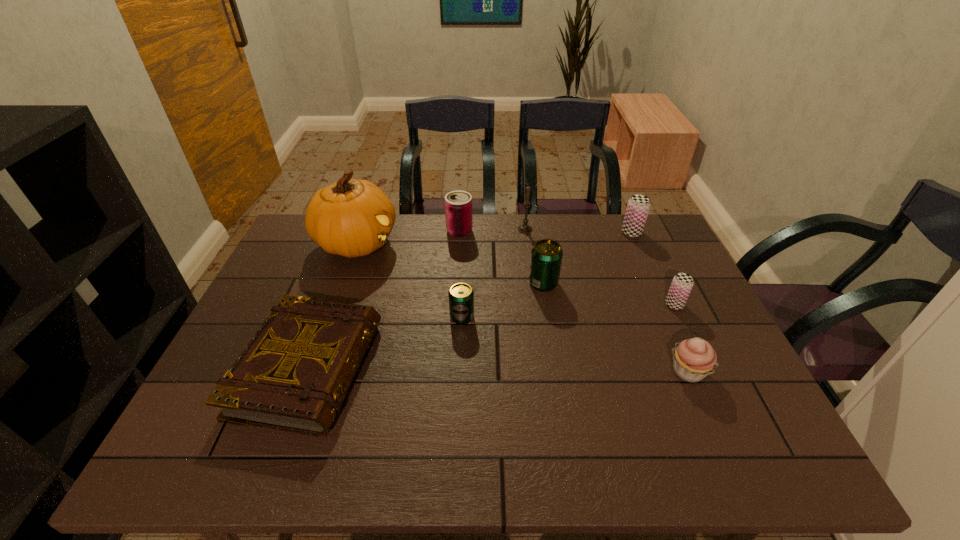
The image size is (960, 540). In order to click on pumpkin in this screenshot , I will do 352,218.

Where is `gray candle`? gray candle is located at coordinates (524, 228).

The height and width of the screenshot is (540, 960). Find the location of `the second tallest object`. the second tallest object is located at coordinates (524, 228).

Locate an element on the screen. This screenshot has height=540, width=960. can is located at coordinates (458, 204).

At what (x,y) coordinates should I click in order to perform the action: click on the farthest beer can. Please return your answer as a coordinate pair (x, y). This screenshot has width=960, height=540. Looking at the image, I should click on (638, 206).

Find the location of a particular element. This screenshot has width=960, height=540. the bigger purple beer can is located at coordinates (638, 206).

This screenshot has width=960, height=540. Identify the location of the fifth farthest object. (546, 255).

You are a GUI agent. You are given a task and a screenshot of the screen. Output one action in this format:
    pyautogui.click(x=<x>, y=<y>)
    Task: Click on the bigger green beer can
    
    Given the screenshot: What is the action you would take?
    pyautogui.click(x=546, y=255)

At what (x,y) coordinates should I click in order to perform the action: click on cupcake. Please return your answer as a coordinate pair (x, y). Looking at the image, I should click on (693, 359).

This screenshot has width=960, height=540. I want to click on the smaller purple beer can, so click(x=681, y=286).